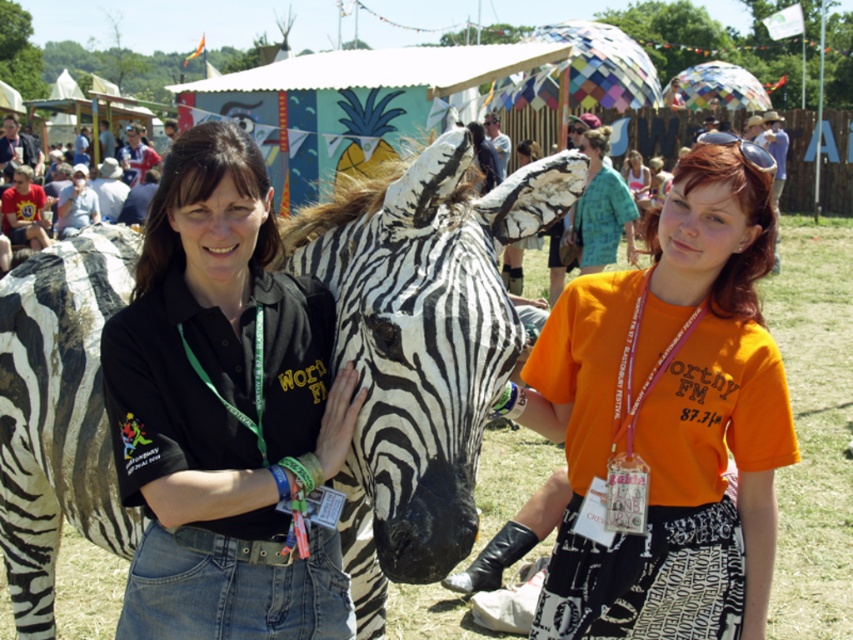
Question: Which point is farther from the camera taking this photo?

Choices:
 (A) (85, 364)
 (B) (276, 314)

Answer: (A)

Question: Does black and white striped zebra at center appear under orange cotton t-shirt at center?

Choices:
 (A) no
 (B) yes

Answer: (B)

Question: Considering the relative positions of black matte shirt at center and orange cotton t-shirt at center in the image provided, where is black matte shirt at center located with respect to orange cotton t-shirt at center?

Choices:
 (A) below
 (B) above

Answer: (B)

Question: Which point appears closest to the camera in this image?

Choices:
 (A) (74, 262)
 (B) (206, 458)

Answer: (B)

Question: Which point is closer to the camera?

Choices:
 (A) (247, 337)
 (B) (733, 390)
 (C) (396, 362)

Answer: (C)

Question: Does black and white striped zebra at center appear under black matte shirt at center?

Choices:
 (A) yes
 (B) no

Answer: (A)